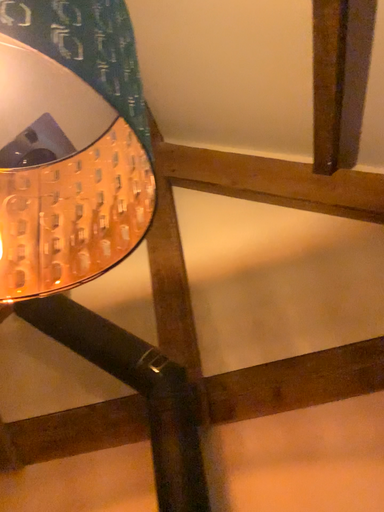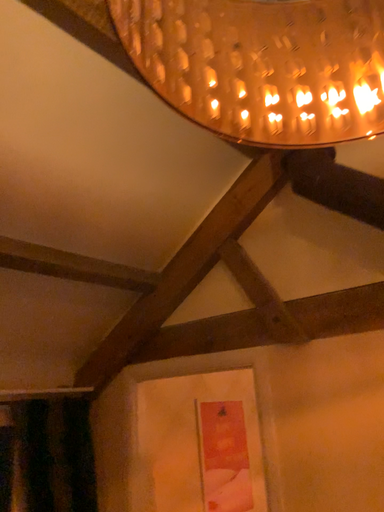
Question: How did the camera likely rotate when shooting the video?

Choices:
 (A) rotated downward
 (B) rotated upward

Answer: (A)